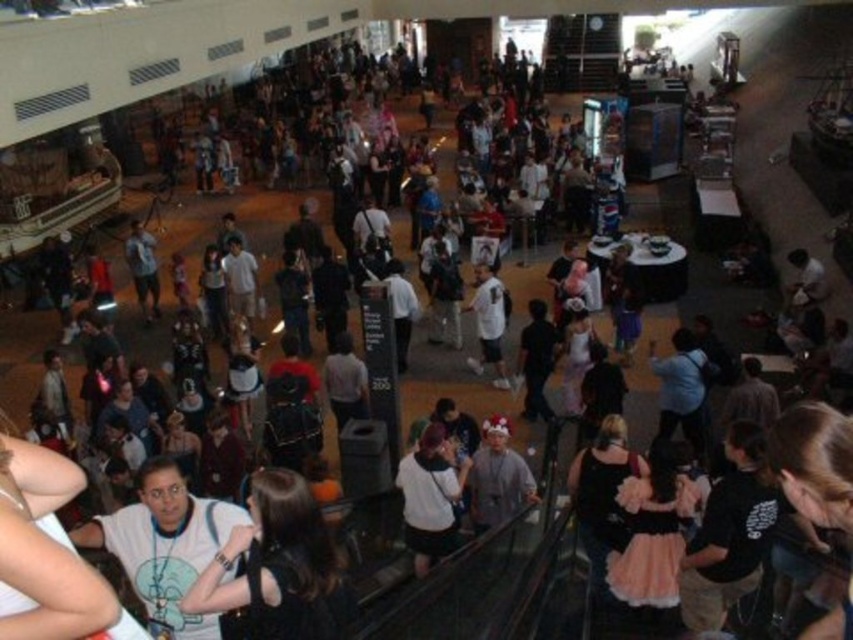
Question: Can you confirm if white matte t-shirt at center is positioned to the right of white matte shirt at center?

Choices:
 (A) no
 (B) yes

Answer: (A)

Question: Which point is farther from the camera taking this photo?

Choices:
 (A) (245, 608)
 (B) (463, 461)
 (C) (485, 296)

Answer: (C)

Question: Among these points, which one is nearest to the camera?

Choices:
 (A) (259, 472)
 (B) (450, 540)
 (C) (212, 509)
 (D) (508, 387)

Answer: (A)

Question: Does white cotton shirt at center appear on the right side of white matte shirt at center?

Choices:
 (A) no
 (B) yes

Answer: (A)

Question: Considering the real-world distances, which object is closest to the white cotton shirt at center?

Choices:
 (A) white matte t-shirt at center
 (B) white t-shirt at center

Answer: (B)

Question: Does white t-shirt at center appear on the left side of white cotton shirt at center?

Choices:
 (A) yes
 (B) no

Answer: (A)